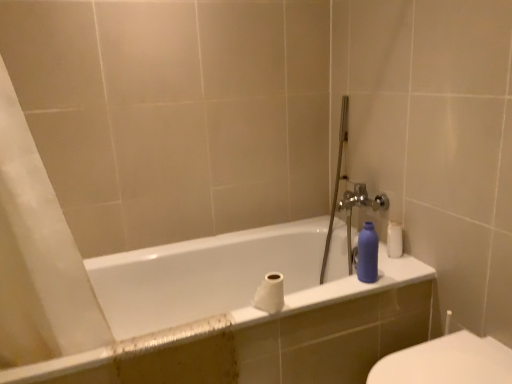
Where is `free location to the left of white matte toilet paper at center`? The width and height of the screenshot is (512, 384). free location to the left of white matte toilet paper at center is located at coordinates (226, 322).